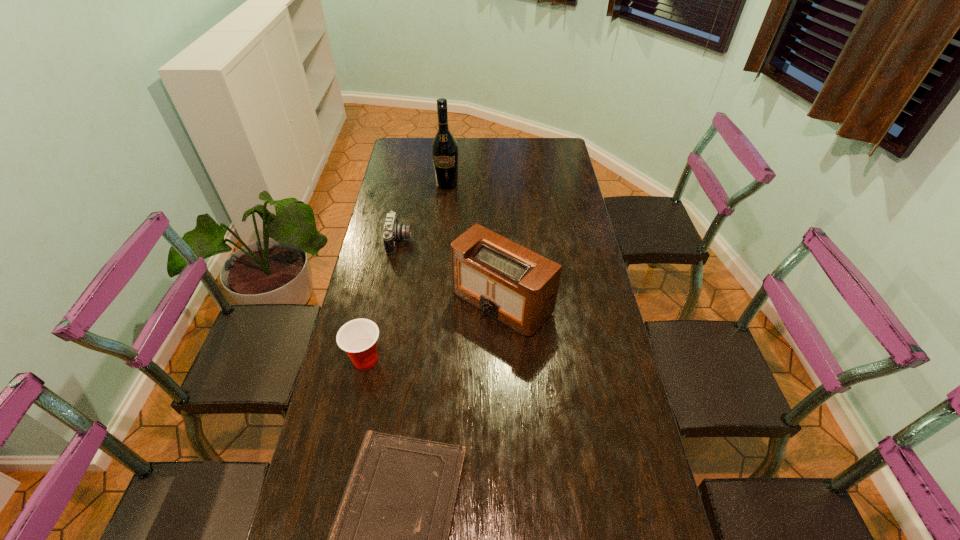
This screenshot has height=540, width=960. Find the location of `vacant space that satisfies the following two spatial constraints: 1. on the label of the third farthest object; 2. on the right side of the tallest object`. vacant space that satisfies the following two spatial constraints: 1. on the label of the third farthest object; 2. on the right side of the tallest object is located at coordinates (436, 302).